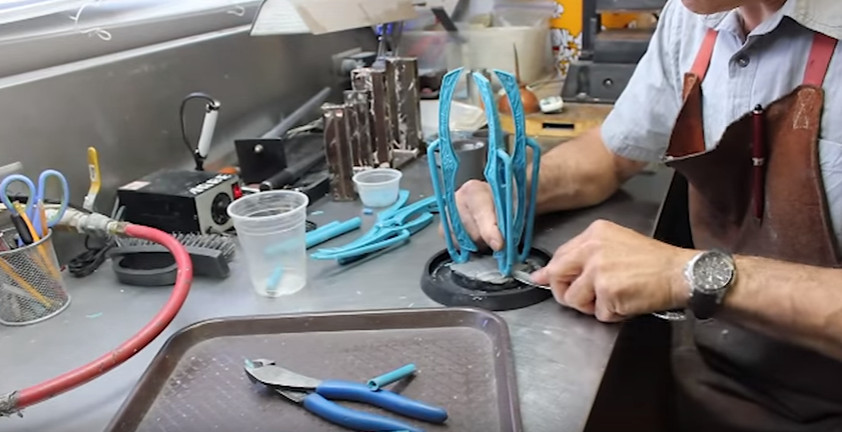
Where is `pens/pencils`? pens/pencils is located at coordinates (24, 216), (4, 251), (14, 224), (43, 212).